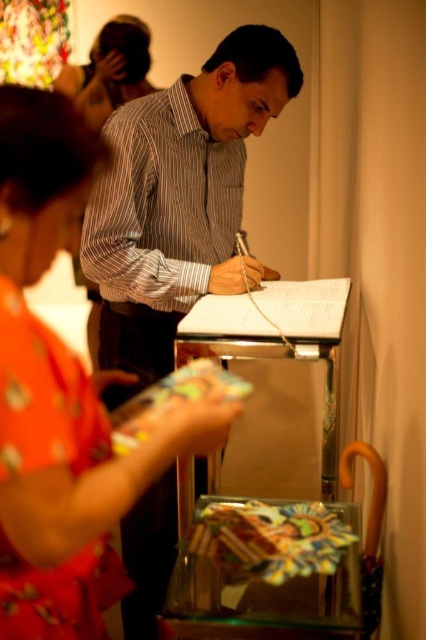
Question: Based on their relative distances, which object is farther from the floral fabric dress at lower left?

Choices:
 (A) striped cotton shirt at center
 (B) striped shirt at center
 (C) matte black hair at upper left

Answer: (C)

Question: Is floral fabric dress at lower left to the left of striped cotton shirt at center from the viewer's perspective?

Choices:
 (A) yes
 (B) no

Answer: (A)

Question: Does floral fabric dress at lower left appear on the left side of striped cotton shirt at center?

Choices:
 (A) yes
 (B) no

Answer: (A)

Question: Which point is farther to the camera?

Choices:
 (A) matte black hair at upper left
 (B) striped cotton shirt at center
 (C) striped shirt at center

Answer: (A)

Question: Can you confirm if floral fabric dress at lower left is smaller than striped cotton shirt at center?

Choices:
 (A) yes
 (B) no

Answer: (A)

Question: Which of the following is the closest to the observer?

Choices:
 (A) striped cotton shirt at center
 (B) striped shirt at center
 (C) matte black hair at upper left
 (D) floral fabric dress at lower left

Answer: (D)